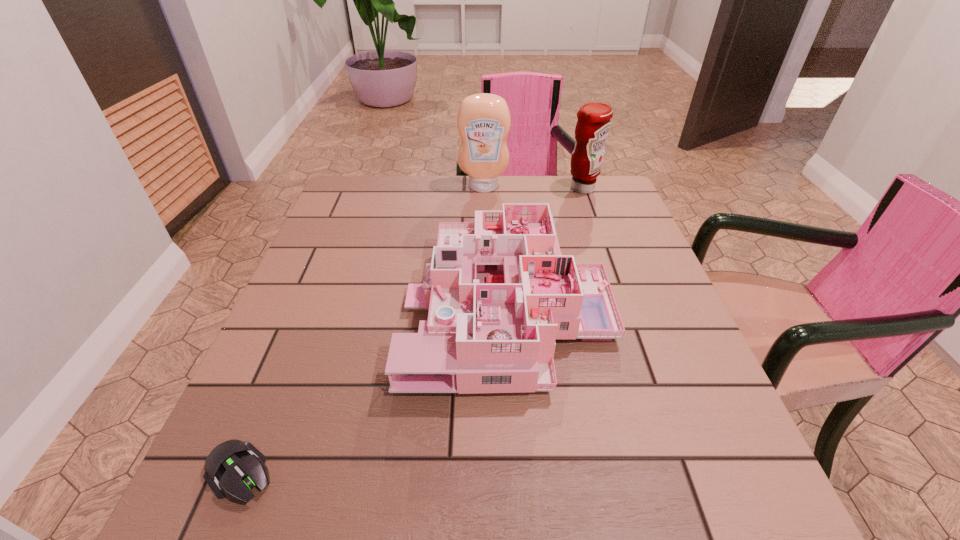
Find the location of a particular element. This screenshot has height=540, width=960. free space at the left edge of the desktop is located at coordinates (303, 268).

Find the location of `vacant space at the right edge of the desktop`. vacant space at the right edge of the desktop is located at coordinates (640, 336).

I want to click on free space at the far left corner of the desktop, so click(x=343, y=179).

Identify the location of free space at the far right corner of the desktop. Image resolution: width=960 pixels, height=540 pixels. (613, 177).

This screenshot has width=960, height=540. Find the location of `free space at the near right corner`. free space at the near right corner is located at coordinates (751, 482).

At what (x,y) coordinates should I click in order to perform the action: click on free point between the right condiment and the leftmost object. Please return your answer as a coordinate pair (x, y). This screenshot has width=960, height=540. Looking at the image, I should click on (412, 330).

The width and height of the screenshot is (960, 540). What are the coordinates of `vacant space that's between the nearest object and the third farthest object` in the screenshot? It's located at (374, 389).

Locate an element on the screen. empty location between the third farthest object and the leftmost object is located at coordinates (374, 389).

At what (x,y) coordinates should I click in order to perform the action: click on vacant area between the nearest object and the second shortest object. Please return your answer as a coordinate pair (x, y). The image size is (960, 540). Looking at the image, I should click on (374, 389).

Where is `empty space that is in between the third tallest object and the shortest object`? empty space that is in between the third tallest object and the shortest object is located at coordinates (374, 389).